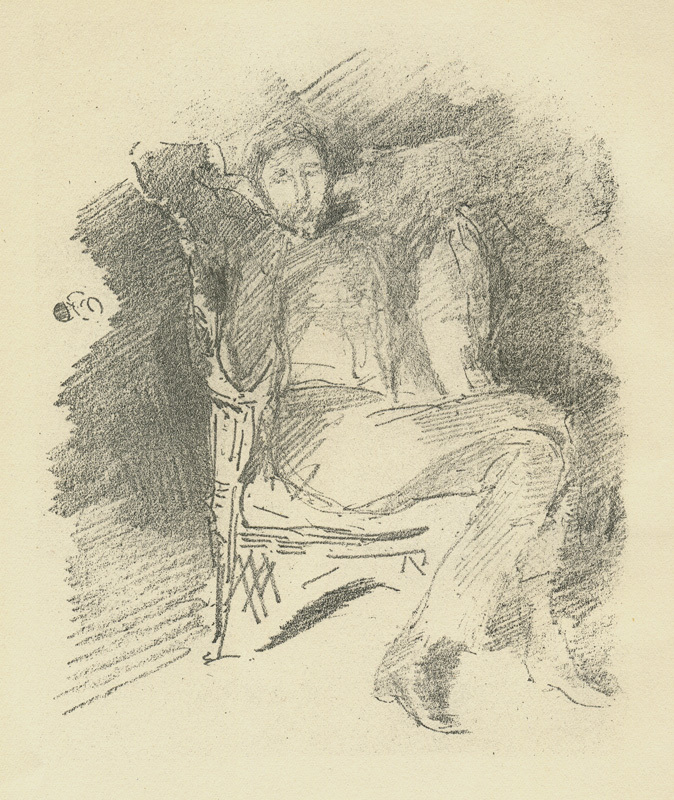
I want to click on floor, so click(x=309, y=672).